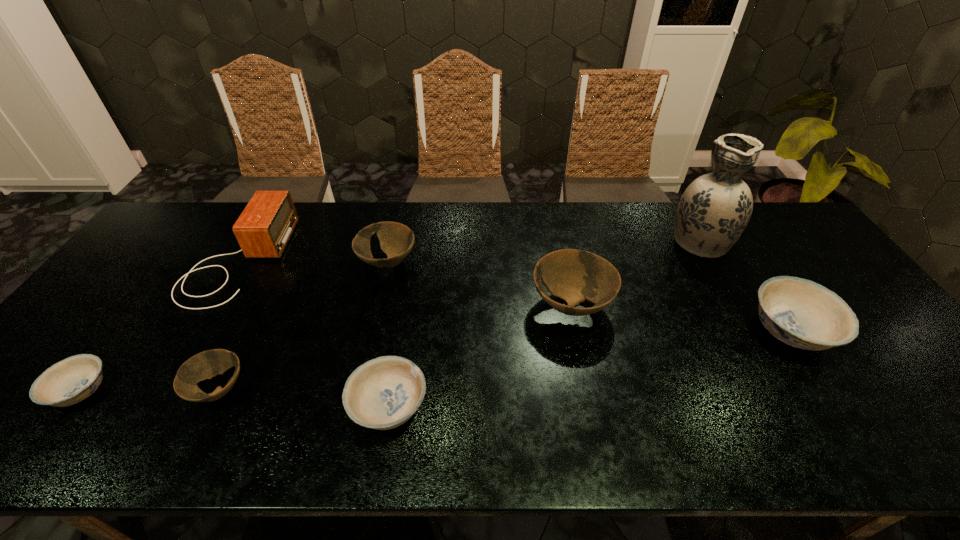
You are a GUI agent. You are given a task and a screenshot of the screen. Output one action in this format:
    pyautogui.click(x=<x>, y=<y>)
    Task: Click on the vacant space located 0.350m on the right of the leftmost blue bowl
    This screenshot has width=960, height=540.
    Given the screenshot: What is the action you would take?
    pyautogui.click(x=260, y=391)

Locate an element on the screen. This screenshot has width=960, height=540. vase located at the far edge is located at coordinates (714, 210).

Where is `radio receiver located in the far edge section of the desktop`? radio receiver located in the far edge section of the desktop is located at coordinates (264, 228).

Locate an element on the screen. The width and height of the screenshot is (960, 540). bowl at the far edge is located at coordinates (396, 240).

At what (x,y) coordinates should I click in order to perform the action: click on object that is at the left edge. Please return your answer as a coordinate pair (x, y). Looking at the image, I should click on (74, 379).

Find the location of a particular element. The width and height of the screenshot is (960, 540). object at the right edge is located at coordinates (801, 313).

Locate an element on the screen. object at the near left corner is located at coordinates (74, 379).

The height and width of the screenshot is (540, 960). In the image, there is a desktop. What are the coordinates of `vacant region at the far edge` in the screenshot? It's located at [617, 242].

Locate an element on the screen. This screenshot has height=540, width=960. free space at the left edge is located at coordinates (150, 275).

The image size is (960, 540). I want to click on vacant space at the right edge, so click(917, 411).